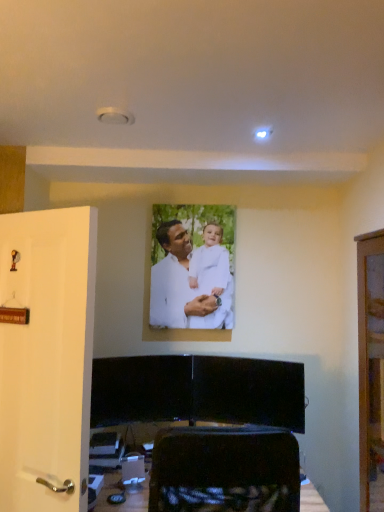
I want to click on white matte portrait at center, so click(x=189, y=283).

This screenshot has height=512, width=384. Describe the element at coordinates (189, 283) in the screenshot. I see `white matte portrait at center` at that location.

What do you see at coordinates (47, 357) in the screenshot? The height and width of the screenshot is (512, 384). I see `white matte door at left` at bounding box center [47, 357].

Locate an element on the screen. white matte door at left is located at coordinates (47, 357).

Measure the distance between white matte door at left and camera.

1.50 meters.

Where is `white matte portrait at center`? This screenshot has width=384, height=512. white matte portrait at center is located at coordinates (189, 283).

From the picture: Is white matte portrait at center at the right side of white matte door at left?

Yes.

Which object is closer to the camera, white matte portrait at center or white matte door at left?

white matte door at left.

Is point (184, 314) closer or farther from the camera than point (16, 453)?

Point (184, 314) is positioned farther from the camera compared to point (16, 453).

From the image's perspective, is white matte portrait at center located beneath white matte door at left?

No, from the image's perspective, white matte portrait at center is not below white matte door at left.

From a real-world perspective, which object rests below the other?

From a 3D spatial view, white matte door at left is below.

Between white matte portrait at center and white matte door at left, which one has larger width?

Wider between the two is white matte door at left.

Looking at this image, from their relative heights in the image, would you say white matte portrait at center is taller or shorter than white matte door at left?

In the image, white matte portrait at center appears to be shorter than white matte door at left.

Considering the relative sizes of white matte portrait at center and white matte door at left in the image provided, is white matte portrait at center bigger than white matte door at left?

No.

Choose the correct answer: Is white matte portrait at center inside white matte door at left or outside it?

white matte portrait at center cannot be found inside white matte door at left.

Are white matte portrait at center and white matte door at left far apart?

Yes.

Is white matte portrait at center positioned with its back to white matte door at left?

No, white matte portrait at center is not facing away from white matte door at left.

This screenshot has height=512, width=384. In order to click on door lying below the white matte portrait at center (from the image's perspective) in this screenshot , I will do `click(47, 357)`.

Which is more to the left, white matte door at left or white matte portrait at center?

white matte door at left is more to the left.

Is white matte door at left in front of or behind white matte portrait at center in the image?

In the image, white matte door at left appears in front of white matte portrait at center.

Considering the positions of points (52, 471) and (179, 249), is point (52, 471) closer to camera compared to point (179, 249)?

Yes, point (52, 471) is in front of point (179, 249).

From the image's perspective, relative to white matte portrait at center, is white matte door at left above or below?

Based on their image positions, white matte door at left is located beneath white matte portrait at center.

From a real-world perspective, who is located higher, white matte door at left or white matte portrait at center?

white matte portrait at center is physically above.

Which of these two, white matte door at left or white matte portrait at center, is wider?

white matte door at left.

Which of these two, white matte door at left or white matte portrait at center, stands taller?

Standing taller between the two is white matte door at left.

Is white matte door at left smaller than white matte portrait at center?

Actually, white matte door at left might be larger than white matte portrait at center.

Can we say white matte door at left lies outside white matte portrait at center?

Indeed, white matte door at left is completely outside white matte portrait at center.

Would you consider white matte door at left to be distant from white matte portrait at center?

white matte door at left is positioned a significant distance from white matte portrait at center.

Is white matte door at left looking in the opposite direction of white matte portrait at center?

Yes, white matte door at left's orientation is away from white matte portrait at center.

How many degrees apart are the facing directions of white matte door at left and white matte portrait at center?

There is a 30.9-degree angle between the facing directions of white matte door at left and white matte portrait at center.

Locate an element on the screen. The width and height of the screenshot is (384, 512). door that is under the white matte portrait at center (from a real-world perspective) is located at coordinates (47, 357).

You are a GUI agent. You are given a task and a screenshot of the screen. Output one action in this format:
    pyautogui.click(x=<x>, y=<y>)
    Task: Click on the man behind the white matte door at left
    The width and height of the screenshot is (384, 512).
    Given the screenshot: What is the action you would take?
    pyautogui.click(x=189, y=283)

Where is `door lying on the left of white matte portrait at center`? Image resolution: width=384 pixels, height=512 pixels. door lying on the left of white matte portrait at center is located at coordinates (47, 357).